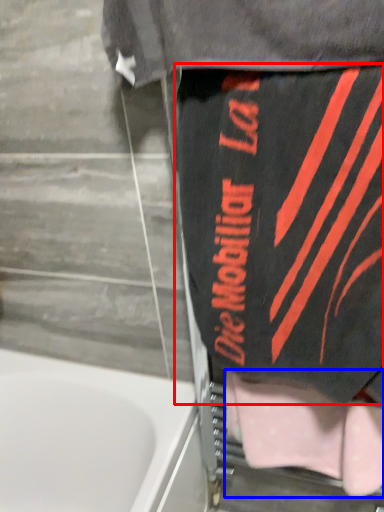
Question: Which object is further to the camera taking this photo, underclothes (highlighted by a red box) or towel (highlighted by a blue box)?

Choices:
 (A) underclothes
 (B) towel

Answer: (B)